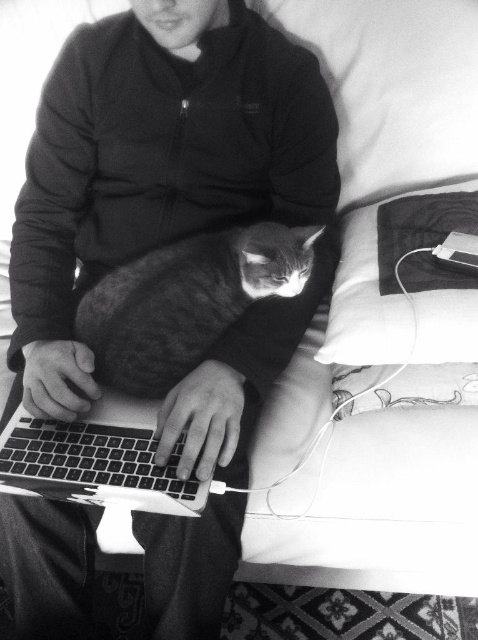
You are a photographer trying to capture a clear shot of the metallic silver laptop at center without the soft fabric hoodie at center blocking it. Based on their positions, is this possible?

The soft fabric hoodie at center is above the metallic silver laptop at center, so it is blocking the laptop. To capture a clear shot of the metallic silver laptop at center, you would need to adjust your angle or position to avoid the obstruction caused by the soft fabric hoodie at center.

You are trying to reach for the metallic silver laptop at center but need to avoid touching the soft fabric hoodie at center. Which direction should you move your hand to safely grab the laptop without touching the hoodie?

The soft fabric hoodie at center is to the left of the metallic silver laptop at center, so you should move your hand to the right to grab the laptop without touching the hoodie.

You are a delivery person who needs to pack the metallic silver laptop at center and the soft fabric hoodie at center into a box. The box can only fit items that are smaller than 18 inches in any dimension. Can both items fit in the box?

The soft fabric hoodie at center is bigger than the metallic silver laptop at center. Since the hoodie is larger, if it is under 18 inches in all dimensions, both can fit. However, if the hoodie exceeds 18 inches in any dimension, it won